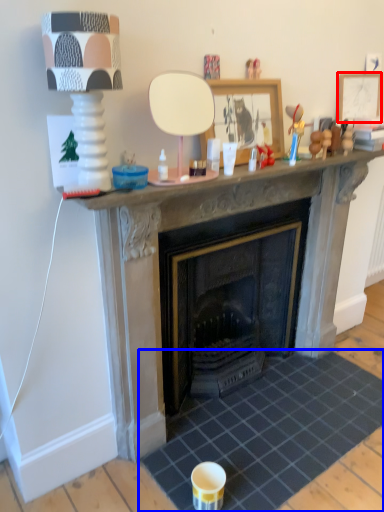
Question: Which point is closer to the camera, picture frame (highlighted by a red box) or tile (highlighted by a blue box)?

Choices:
 (A) picture frame
 (B) tile

Answer: (B)